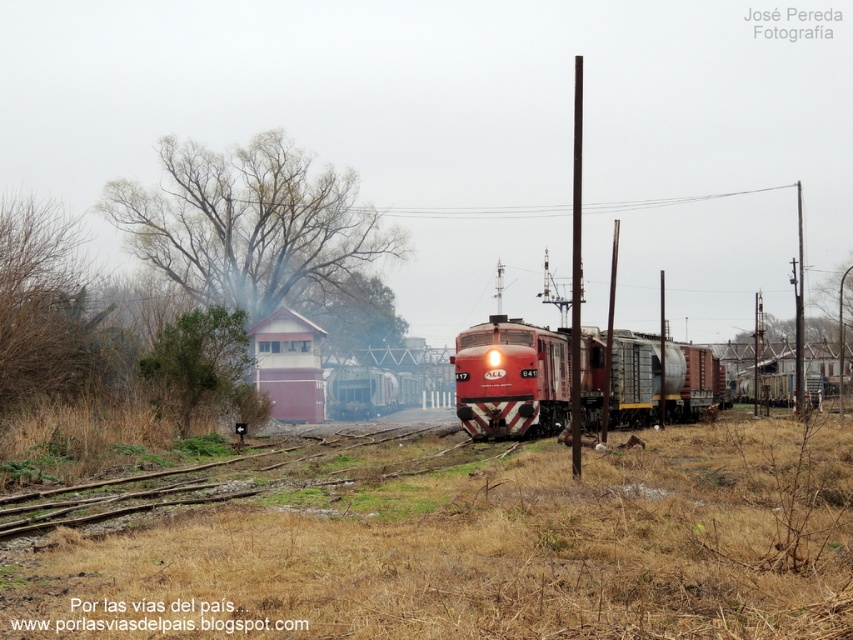
Which is behind, point (596, 349) or point (438, 429)?

The point (438, 429) is behind.

Does matte red train at center appear on the left side of wooden track at lower left?

No, matte red train at center is not to the left of wooden track at lower left.

Does point (664, 392) come farther from viewer compared to point (219, 493)?

Yes, it is behind point (219, 493).

Locate an element on the screen. The image size is (853, 640). matte red train at center is located at coordinates (524, 378).